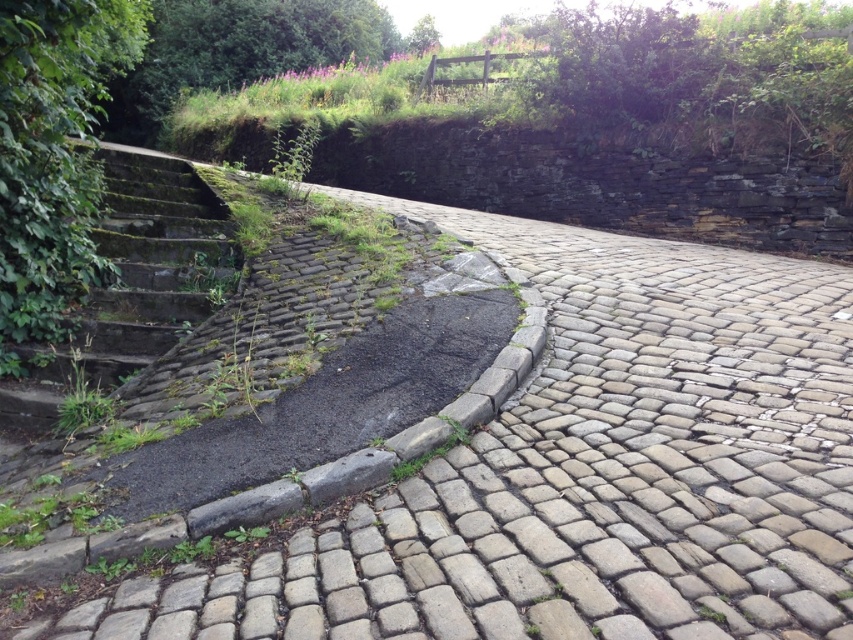
Question: Among these points, which one is farthest from the camera?

Choices:
 (A) (125, 204)
 (B) (437, 468)

Answer: (A)

Question: Can you confirm if gray cobblestone pavement at center is smaller than mossy stone stairs at left?

Choices:
 (A) yes
 (B) no

Answer: (B)

Question: Does gray cobblestone pavement at center appear under mossy stone stairs at left?

Choices:
 (A) yes
 (B) no

Answer: (A)

Question: Can you confirm if gray cobblestone pavement at center is bigger than mossy stone stairs at left?

Choices:
 (A) yes
 (B) no

Answer: (A)